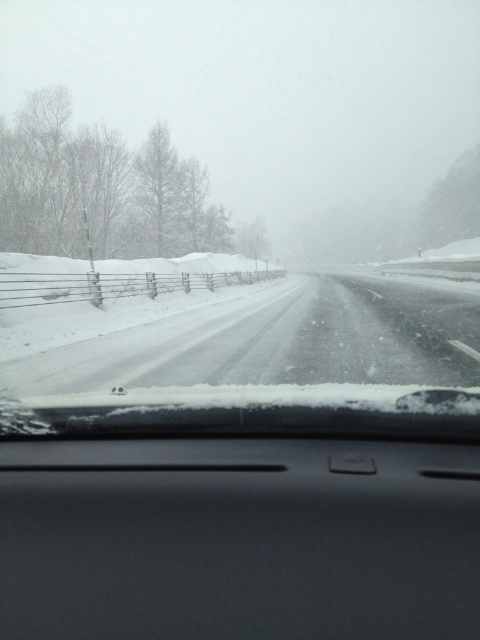
You are driving a car and looking through the windshield. There is a point at coordinate (238, 538) on the windshield. What object is located at that point?

The point at coordinate (238, 538) is where the black matte dashboard at center is located.

You are a driver checking the visibility through your windshield. You notice the black matte dashboard at center and the snowy asphalt highway at center. Which of these two objects takes up more space in your current view?

The snowy asphalt highway at center takes up more space in your current view because the black matte dashboard at center occupies less space than it.

You are driving a car and notice the black matte dashboard at center. Where exactly is it positioned in the image?

The black matte dashboard at center is positioned at point coordinates of 0.842 on the x axis and 0.496 on the y axis.